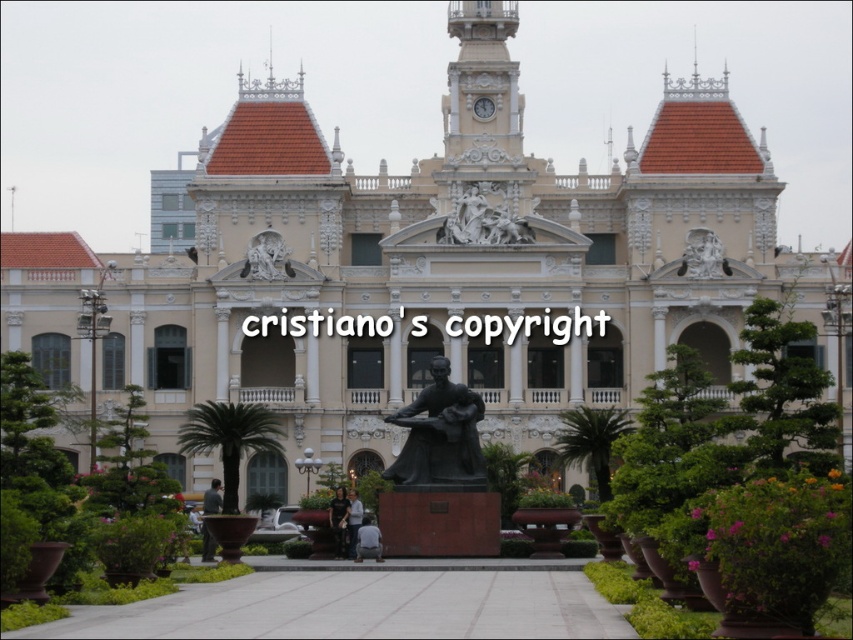
This screenshot has width=853, height=640. I want to click on white marble sculpture at center, so click(x=482, y=220).

The image size is (853, 640). Describe the element at coordinates (482, 220) in the screenshot. I see `white marble sculpture at center` at that location.

The height and width of the screenshot is (640, 853). What are the coordinates of `white marble sculpture at center` in the screenshot? It's located at (482, 220).

The image size is (853, 640). I want to click on white marble statue at upper center, so click(265, 257).

Is white marble statue at upper center smaller than matte white clock at upper center?

No.

Between point (253, 268) and point (492, 113), which one is positioned behind?

Point (492, 113)

Find the location of a particular element. The image size is (853, 640). white marble statue at upper center is located at coordinates (265, 257).

Where is `white marble sculpture at center`? white marble sculpture at center is located at coordinates (482, 220).